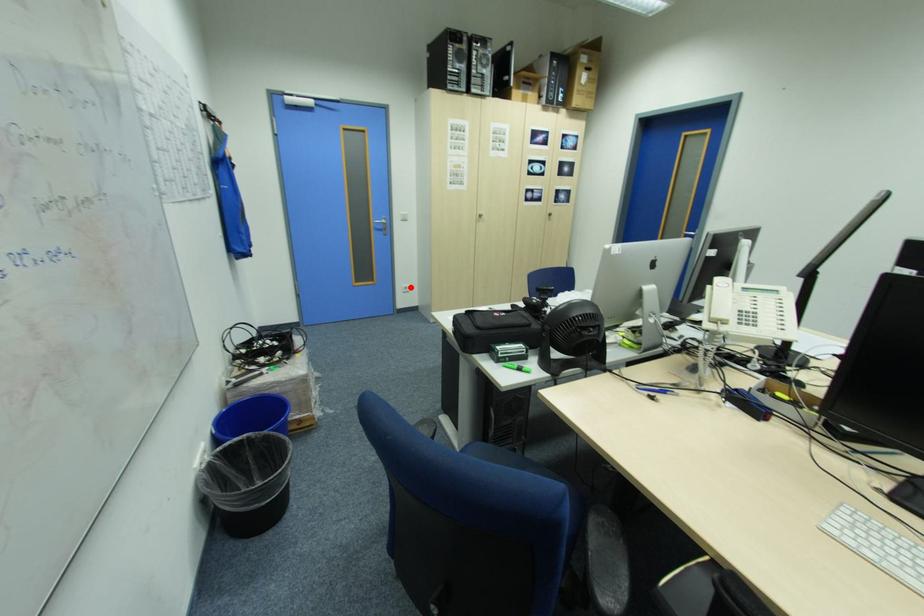
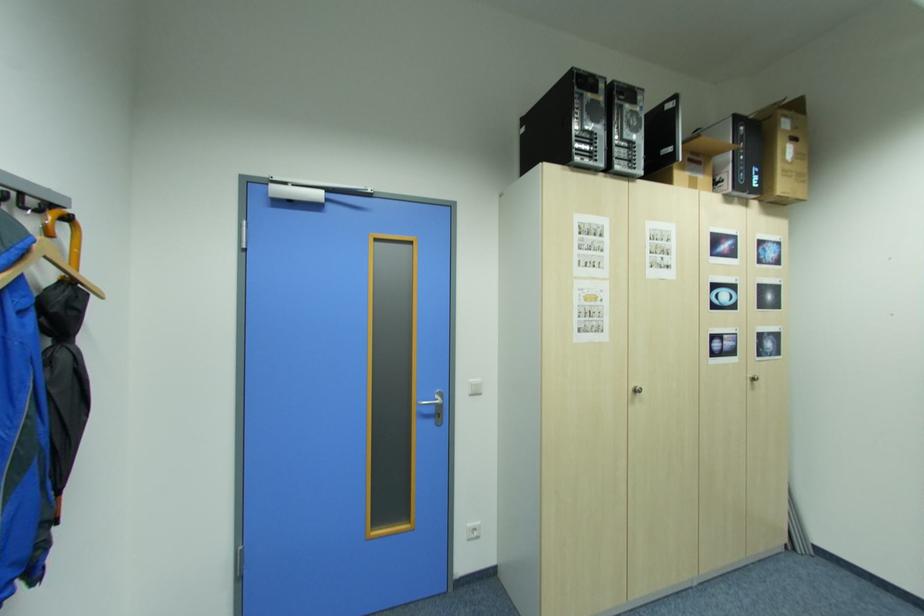
Where in the second image is the point corresponding to the highlighted location from the first image?

(476, 529)